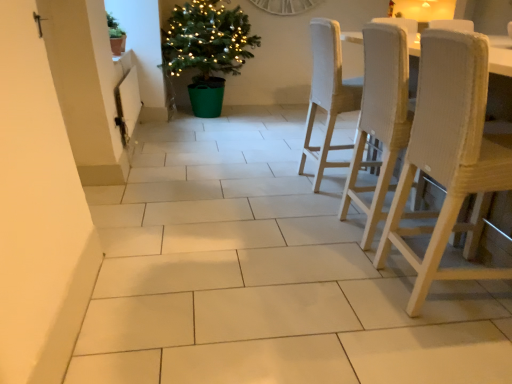
Find the location of a particular element. green matte pot at upper left, positioned as the second houseplant in back-to-front order is located at coordinates (116, 36).

Find the location of a particular element. This screenshot has width=512, height=384. woven fabric chair at right, the 2th chair viewed from the front is located at coordinates (380, 118).

Describe the element at coordinates (448, 154) in the screenshot. I see `white textured wood chair at right, the third chair from the back` at that location.

What do you see at coordinates (328, 94) in the screenshot?
I see `light beige woven chair at center right, the 1th chair viewed from the back` at bounding box center [328, 94].

What are the coordinates of `matte brown pot at upper left` in the screenshot? It's located at (118, 44).

In order to click on green matte pot at upper left, which is the 2th houseplant from right to left in this screenshot , I will do `click(116, 36)`.

Who is taller, matte brown pot at upper left or light beige woven chair at center right, the 3th chair in the front-to-back sequence?

With more height is light beige woven chair at center right, the 3th chair in the front-to-back sequence.

From the image's perspective, is matte brown pot at upper left on light beige woven chair at center right, the 1th chair viewed from the back?

Yes, from the image's perspective, matte brown pot at upper left is on top of light beige woven chair at center right, the 1th chair viewed from the back.

Considering the sizes of matte brown pot at upper left and light beige woven chair at center right, the 1th chair viewed from the back, in the image, is matte brown pot at upper left wider or thinner than light beige woven chair at center right, the 1th chair viewed from the back,?

Considering their sizes, matte brown pot at upper left looks slimmer than light beige woven chair at center right, the 1th chair viewed from the back.

Considering the relative sizes of matte brown pot at upper left and light beige woven chair at center right, the 3th chair in the front-to-back sequence, in the image provided, is matte brown pot at upper left bigger than light beige woven chair at center right, the 3th chair in the front-to-back sequence,?

Actually, matte brown pot at upper left might be smaller than light beige woven chair at center right, the 3th chair in the front-to-back sequence.

Can you confirm if white textured wood chair at right, the third chair from the back, is taller than woven fabric chair at right, acting as the second chair starting from the back?

Incorrect, the height of white textured wood chair at right, the third chair from the back, is not larger of that of woven fabric chair at right, acting as the second chair starting from the back.

Is point (456, 54) more distant than point (373, 117)?

No, (456, 54) is closer to viewer.

Does white textured wood chair at right, the third chair from the back, appear on the left side of woven fabric chair at right, the 2th chair viewed from the front?

In fact, white textured wood chair at right, the third chair from the back, is to the right of woven fabric chair at right, the 2th chair viewed from the front.

Which of these two, white textured wood chair at right, the third chair from the back, or woven fabric chair at right, acting as the second chair starting from the back, is smaller?

Smaller between the two is white textured wood chair at right, the third chair from the back.

You are a GUI agent. You are given a task and a screenshot of the screen. Output one action in this format:
    pyautogui.click(x=<x>, y=<y>)
    Task: Click on the 1st chair below when counting from the matte brown pot at upper left (from the image's perspective)
    Image resolution: width=512 pixels, height=384 pixels.
    Given the screenshot: What is the action you would take?
    pyautogui.click(x=328, y=94)

From a real-world perspective, which object rests below the other?

light beige woven chair at center right, the 3th chair in the front-to-back sequence, is physically lower.

Is light beige woven chair at center right, the 1th chair viewed from the back, outside of matte brown pot at upper left?

light beige woven chair at center right, the 1th chair viewed from the back, is positioned outside matte brown pot at upper left.

Which of these two, light beige woven chair at center right, the 1th chair viewed from the back, or matte brown pot at upper left, stands taller?

light beige woven chair at center right, the 1th chair viewed from the back.

Based on the photo, between woven fabric chair at right, the 2th chair viewed from the front, and green plastic potted plant at center-left, which appears as the 2th houseplant when viewed from the left, which one has larger width?

green plastic potted plant at center-left, which appears as the 2th houseplant when viewed from the left, is wider.

Can you confirm if woven fabric chair at right, the 2th chair viewed from the front, is smaller than green plastic potted plant at center-left, which appears as the 2th houseplant when viewed from the front?

Yes, woven fabric chair at right, the 2th chair viewed from the front, is smaller than green plastic potted plant at center-left, which appears as the 2th houseplant when viewed from the front.

From a real-world perspective, which object rests below the other?

From a 3D spatial view, woven fabric chair at right, acting as the second chair starting from the back, is below.

Is woven fabric chair at right, acting as the second chair starting from the back, closer to the viewer compared to green plastic potted plant at center-left, which appears as the 2th houseplant when viewed from the left?

Yes, woven fabric chair at right, acting as the second chair starting from the back, is in front of green plastic potted plant at center-left, which appears as the 2th houseplant when viewed from the left.

Considering the sizes of objects matte brown pot at upper left and woven fabric chair at right, the 2th chair viewed from the front, in the image provided, who is thinner, matte brown pot at upper left or woven fabric chair at right, the 2th chair viewed from the front,?

Thinner between the two is matte brown pot at upper left.

Looking at this image, could you tell me if matte brown pot at upper left is facing woven fabric chair at right, the 2th chair viewed from the front?

No, matte brown pot at upper left is not facing towards woven fabric chair at right, the 2th chair viewed from the front.

You are a GUI agent. You are given a task and a screenshot of the screen. Output one action in this format:
    pyautogui.click(x=<x>, y=<y>)
    Task: Click on the flowerpot located above the woven fabric chair at right, the 2th chair viewed from the front (from a real-world perspective)
    The height and width of the screenshot is (384, 512).
    Given the screenshot: What is the action you would take?
    pyautogui.click(x=118, y=44)

How many degrees apart are the facing directions of matte brown pot at upper left and woven fabric chair at right, acting as the second chair starting from the back?

There is a 3.14-degree angle between the facing directions of matte brown pot at upper left and woven fabric chair at right, acting as the second chair starting from the back.

From the image's perspective, between green matte pot at upper left, the 1th houseplant from the left, and matte brown pot at upper left, who is located below?

matte brown pot at upper left, from the image's perspective.

Considering the relative positions of green matte pot at upper left, positioned as the second houseplant in back-to-front order, and matte brown pot at upper left in the image provided, is green matte pot at upper left, positioned as the second houseplant in back-to-front order, in front of matte brown pot at upper left?

No, green matte pot at upper left, positioned as the second houseplant in back-to-front order, is further to the viewer.

Looking at this image, is matte brown pot at upper left at the back of green matte pot at upper left, marked as the 1th houseplant in a front-to-back arrangement?

No.

Is green matte pot at upper left, positioned as the second houseplant in back-to-front order, positioned beyond the bounds of matte brown pot at upper left?

green matte pot at upper left, positioned as the second houseplant in back-to-front order, lies outside matte brown pot at upper left's area.

From the picture: How distant is green matte pot at upper left, which is the 2th houseplant from right to left, from white textured wood chair at right, which is the 1th chair from front to back?

They are 9.08 feet apart.

What's the angular difference between green matte pot at upper left, positioned as the second houseplant in back-to-front order, and white textured wood chair at right, the third chair from the back,'s facing directions?

1.68 degrees separate the facing orientations of green matte pot at upper left, positioned as the second houseplant in back-to-front order, and white textured wood chair at right, the third chair from the back.

Does green matte pot at upper left, positioned as the second houseplant in back-to-front order, have a greater height compared to white textured wood chair at right, which is the 1th chair from front to back?

No.

Looking at this image, from the image's perspective, relative to white textured wood chair at right, the third chair from the back, is green matte pot at upper left, which is the 2th houseplant from right to left, above or below?

From the image's perspective, green matte pot at upper left, which is the 2th houseplant from right to left, appears above white textured wood chair at right, the third chair from the back.

Locate an element on the screen. The height and width of the screenshot is (384, 512). the 1st chair in front of the matte brown pot at upper left is located at coordinates (328, 94).

Locate an element on the screen. This screenshot has height=384, width=512. chair above the white textured wood chair at right, which is the 1th chair from front to back (from a real-world perspective) is located at coordinates (380, 118).

Considering their positions, is green matte pot at upper left, marked as the 1th houseplant in a front-to-back arrangement, positioned further to light beige woven chair at center right, the 1th chair viewed from the back, than woven fabric chair at right, the 2th chair viewed from the front?

green matte pot at upper left, marked as the 1th houseplant in a front-to-back arrangement.

When comparing their distances from white textured wood chair at right, which is the 1th chair from front to back, does matte brown pot at upper left or green plastic potted plant at center-left, which ranks as the first houseplant in right-to-left order, seem closer?

matte brown pot at upper left is positioned closer to the anchor white textured wood chair at right, which is the 1th chair from front to back.

From the picture: Estimate the real-world distances between objects in this image. Which object is closer to woven fabric chair at right, acting as the second chair starting from the back, white textured wood chair at right, which is the 1th chair from front to back, or light beige woven chair at center right, the 3th chair in the front-to-back sequence?

white textured wood chair at right, which is the 1th chair from front to back, lies closer to woven fabric chair at right, acting as the second chair starting from the back, than the other object.

When comparing their distances from woven fabric chair at right, the 2th chair viewed from the front, does green plastic potted plant at center-left, which appears as the 2th houseplant when viewed from the front, or light beige woven chair at center right, the 1th chair viewed from the back, seem further?

The object further to woven fabric chair at right, the 2th chair viewed from the front, is green plastic potted plant at center-left, which appears as the 2th houseplant when viewed from the front.

Considering their positions, is green plastic potted plant at center-left, the 1th houseplant in the back-to-front sequence, positioned further to white textured wood chair at right, which is the 1th chair from front to back, than light beige woven chair at center right, the 1th chair viewed from the back?

Based on the image, green plastic potted plant at center-left, the 1th houseplant in the back-to-front sequence, appears to be further to white textured wood chair at right, which is the 1th chair from front to back.

Looking at the image, which one is located closer to light beige woven chair at center right, the 1th chair viewed from the back, woven fabric chair at right, the 2th chair viewed from the front, or white textured wood chair at right, which is the 1th chair from front to back?

woven fabric chair at right, the 2th chair viewed from the front, lies closer to light beige woven chair at center right, the 1th chair viewed from the back, than the other object.

Based on their spatial positions, is light beige woven chair at center right, the 3th chair in the front-to-back sequence, or white textured wood chair at right, which is the 1th chair from front to back, further from matte brown pot at upper left?

Based on the image, white textured wood chair at right, which is the 1th chair from front to back, appears to be further to matte brown pot at upper left.

Based on their spatial positions, is matte brown pot at upper left or green matte pot at upper left, the 1th houseplant from the left, further from white textured wood chair at right, the third chair from the back?

matte brown pot at upper left.

You are a GUI agent. You are given a task and a screenshot of the screen. Output one action in this format:
    pyautogui.click(x=<x>, y=<y>)
    Task: Click on the flowerpot located between green matte pot at upper left, marked as the 1th houseplant in a front-to-back arrangement, and light beige woven chair at center right, the 3th chair in the front-to-back sequence, in the left-right direction
    The height and width of the screenshot is (384, 512).
    Given the screenshot: What is the action you would take?
    pyautogui.click(x=118, y=44)

Where is `houseplant positioned between woven fabric chair at right, the 2th chair viewed from the front, and green plastic potted plant at center-left, which appears as the 2th houseplant when viewed from the front, from near to far`? This screenshot has width=512, height=384. houseplant positioned between woven fabric chair at right, the 2th chair viewed from the front, and green plastic potted plant at center-left, which appears as the 2th houseplant when viewed from the front, from near to far is located at coordinates (116, 36).

Identify the location of flowerpot between green matte pot at upper left, the 1th houseplant from the left, and green plastic potted plant at center-left, which appears as the 2th houseplant when viewed from the left, in the horizontal direction. This screenshot has height=384, width=512. (118, 44).

The height and width of the screenshot is (384, 512). I want to click on flowerpot positioned between white textured wood chair at right, the third chair from the back, and green plastic potted plant at center-left, which ranks as the first houseplant in right-to-left order, from near to far, so click(118, 44).